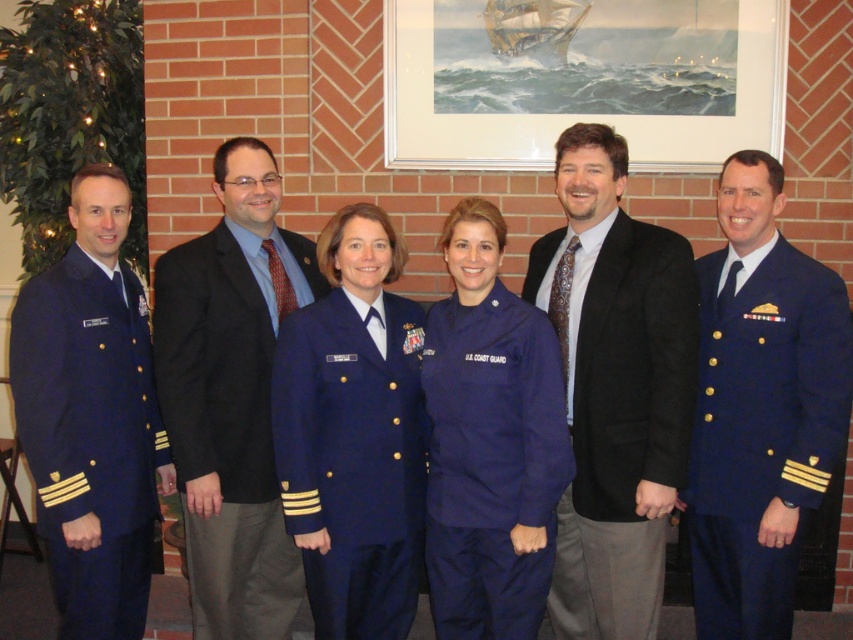
You are a photographer who needs to capture a clear photo of the dark brown suit at center. However, the matte black suit at center is blocking the view. Can you adjust your position to take the photo without obstruction?

The dark brown suit at center is in front of the matte black suit at center, so you can take the photo without moving the subjects as the dark brown suit is already visible in front.

You are a photographer setting up for a group photo. You need to position a spotlight so it can illuminate both the dark brown suit at center and the navy blue woolen uniform at right equally. Given their positions, which object should you place the spotlight closer to?

The dark brown suit at center is closer to the viewer than the navy blue woolen uniform at right, so you should place the spotlight closer to the navy blue woolen uniform at right to ensure equal illumination.

You are attending a formal event and need to find the dark brown suit at center and the matte black suit at center. Which one is located to the right of the other?

The dark brown suit at center is positioned on the right side of matte black suit at center.